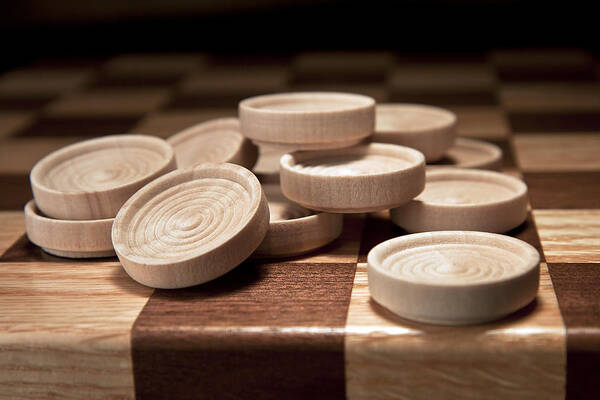
Identify the location of light brown hardwood squares. (364, 312), (76, 313).